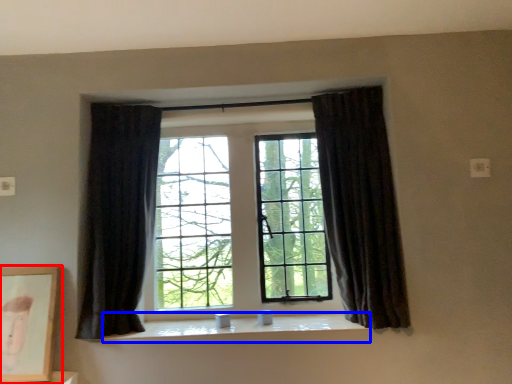
Question: Which object is closer to the camera taking this photo, picture frame (highlighted by a red box) or window sill (highlighted by a blue box)?

Choices:
 (A) picture frame
 (B) window sill

Answer: (A)